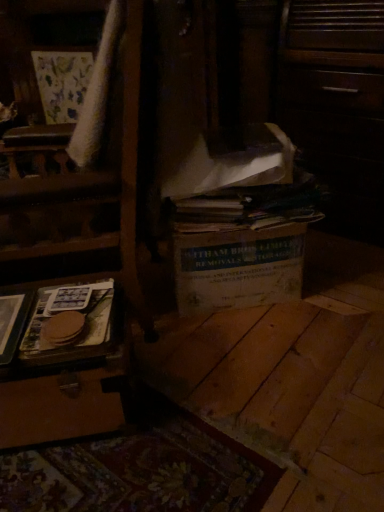
Question: Would you say velvet-like beige armchair at upper left is outside brown paper at lower left?

Choices:
 (A) yes
 (B) no

Answer: (A)

Question: Considering the relative sizes of velvet-like beige armchair at upper left and brown paper at lower left in the image provided, is velvet-like beige armchair at upper left thinner than brown paper at lower left?

Choices:
 (A) yes
 (B) no

Answer: (B)

Question: Is velvet-like beige armchair at upper left wider than brown paper at lower left?

Choices:
 (A) yes
 (B) no

Answer: (A)

Question: Is velvet-like beige armchair at upper left to the left of brown paper at lower left from the viewer's perspective?

Choices:
 (A) no
 (B) yes

Answer: (B)

Question: Is velvet-like beige armchair at upper left placed right next to brown paper at lower left?

Choices:
 (A) no
 (B) yes

Answer: (A)

Question: Would you say velvet-like beige armchair at upper left is to the left or to the right of white cardboard box at center in the picture?

Choices:
 (A) right
 (B) left

Answer: (B)

Question: Considering the positions of velvet-like beige armchair at upper left and white cardboard box at center in the image, is velvet-like beige armchair at upper left wider or thinner than white cardboard box at center?

Choices:
 (A) wide
 (B) thin

Answer: (B)

Question: Considering the positions of point (49, 71) and point (264, 241), is point (49, 71) closer or farther from the camera than point (264, 241)?

Choices:
 (A) closer
 (B) farther

Answer: (B)

Question: In the image, is velvet-like beige armchair at upper left positioned in front of or behind white cardboard box at center?

Choices:
 (A) behind
 (B) front

Answer: (A)

Question: Is velvet-like beige armchair at upper left in front of or behind brown paper at lower left in the image?

Choices:
 (A) behind
 (B) front

Answer: (A)

Question: Would you say velvet-like beige armchair at upper left is to the left or to the right of brown paper at lower left in the picture?

Choices:
 (A) right
 (B) left

Answer: (B)

Question: Does point (56, 98) appear closer or farther from the camera than point (51, 289)?

Choices:
 (A) farther
 (B) closer

Answer: (A)

Question: In terms of size, does velvet-like beige armchair at upper left appear bigger or smaller than brown paper at lower left?

Choices:
 (A) small
 (B) big

Answer: (B)

Question: Looking at the image, does white cardboard box at center seem bigger or smaller compared to velvet-like beige armchair at upper left?

Choices:
 (A) small
 (B) big

Answer: (A)

Question: In terms of width, does white cardboard box at center look wider or thinner when compared to velvet-like beige armchair at upper left?

Choices:
 (A) thin
 (B) wide

Answer: (B)